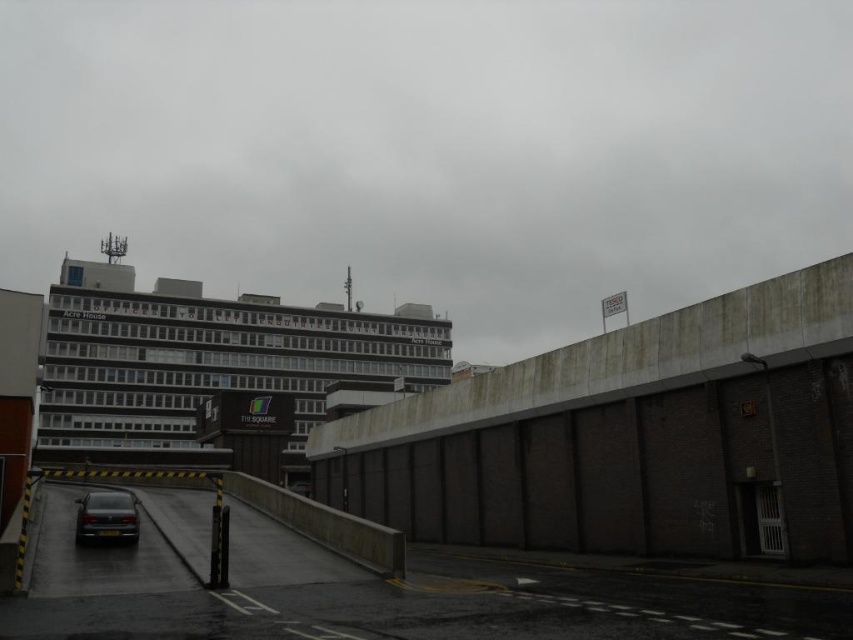
You are standing at the point marked as point (206, 364) in the image. Looking around, what large structure do you see directly in front of you?

At point (206, 364) lies dark gray concrete building at upper center.